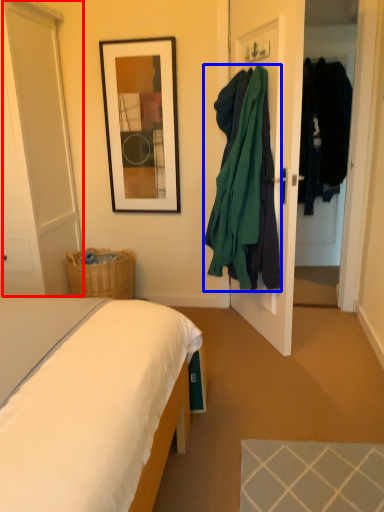
Question: Which object appears farthest to the camera in this image, glass door (highlighted by a red box) or clothing (highlighted by a blue box)?

Choices:
 (A) glass door
 (B) clothing

Answer: (A)